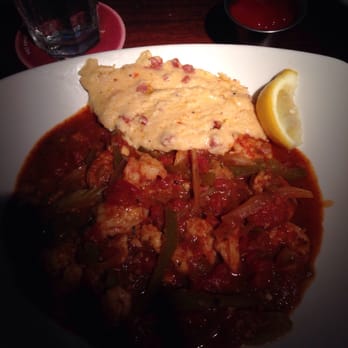
Where is `light pink line around pink coaster`? light pink line around pink coaster is located at coordinates (123, 28).